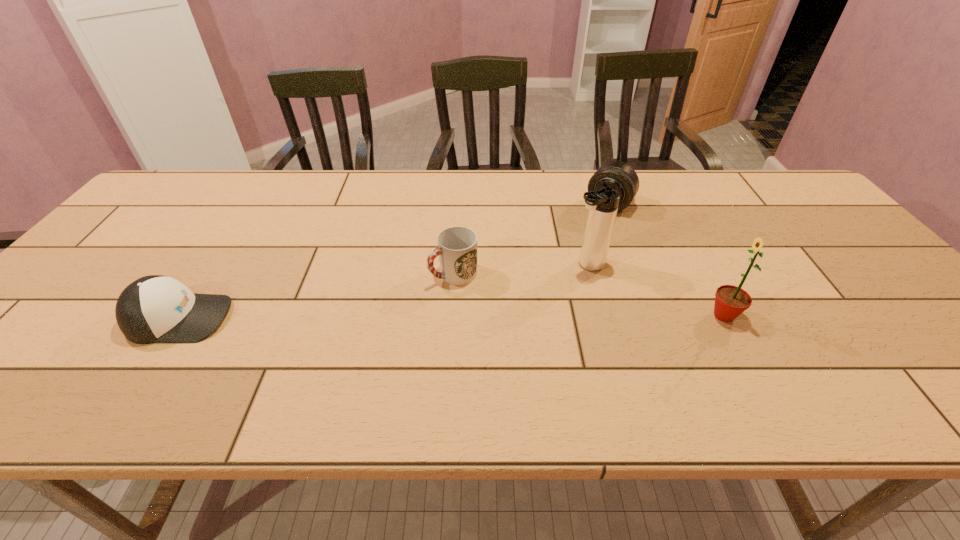
This screenshot has width=960, height=540. I want to click on free space between the rightmost object and the leftmost object, so click(451, 317).

Locate an element on the screen. empty location between the leftmost object and the third tallest object is located at coordinates (394, 261).

Locate an element on the screen. The height and width of the screenshot is (540, 960). free space between the thermos bottle and the second object from left to right is located at coordinates (520, 269).

At what (x,y) coordinates should I click in order to perform the action: click on object that is the fourth closest to the third tallest object. Please return your answer as a coordinate pair (x, y). The image size is (960, 540). Looking at the image, I should click on (153, 309).

Select which object appears as the second closest to the second object from left to right. Please provide its 2D coordinates. Your answer should be formatted as a tuple, i.e. [(x, y)], where the tuple contains the x and y coordinates of a point satisfying the conditions above.

[(620, 176)]

Find the location of `free spot that satisfies the following two spatial constraints: 1. on the front side of the cup; 2. on the face of the sunflower`. free spot that satisfies the following two spatial constraints: 1. on the front side of the cup; 2. on the face of the sunflower is located at coordinates (451, 315).